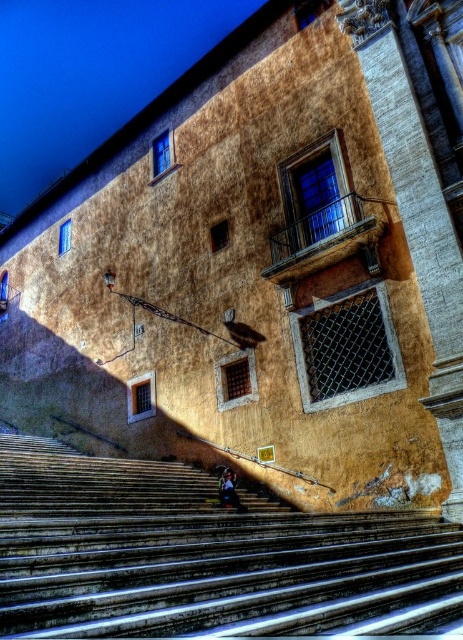
You are standing at the base of the stone steps leading to the historic building. There is a point marked at coordinates (204, 556). Based on the scene description, what is located at this point?

The point at coordinates (204, 556) indicates smooth concrete stairs at center.

You are a delivery person carrying a heavy box and need to climb the smooth concrete stairs at center. The dark blue fabric at center is a rug placed on the stairs. Since the stairs are higher than the rug, will the rug provide enough grip for your box?

The smooth concrete stairs at center has a greater height compared to dark blue fabric at center. The rug may not cover the entire step height, so the grip might be insufficient for the box.